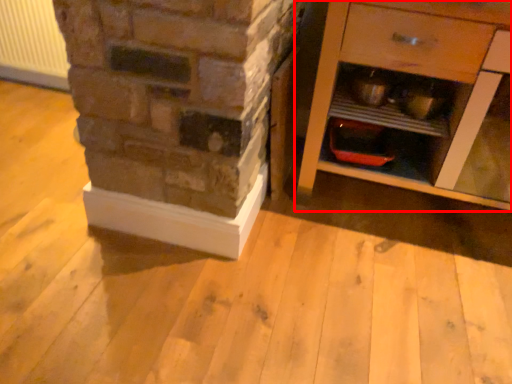
Question: Where is chest of drawers (annotated by the red box) located in relation to radiator in the image?

Choices:
 (A) right
 (B) left

Answer: (A)